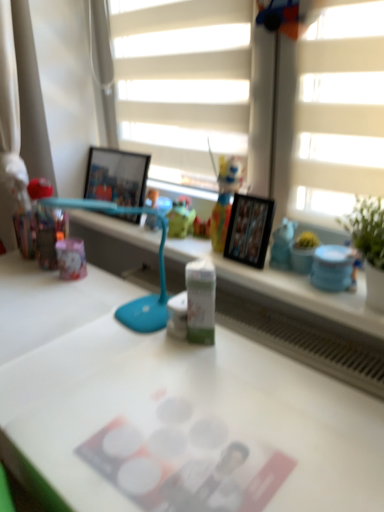
The height and width of the screenshot is (512, 384). Identify the location of vacant area located to the right-hand side of teal plastic table lamp at center. (208, 349).